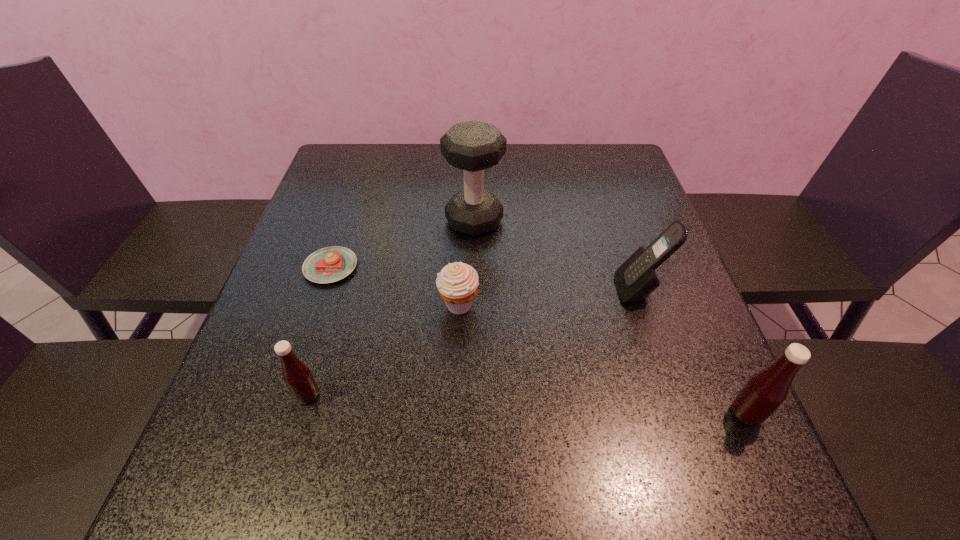
Locate an element on the screen. object that stands as the second closest to the dumbbell is located at coordinates (330, 264).